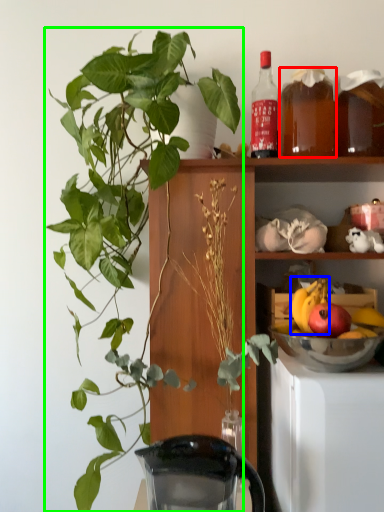
Question: Estimate the real-world distances between objects in this image. Which object is closer to beverage (highlighted by a red box), fruit (highlighted by a blue box) or houseplant (highlighted by a green box)?

Choices:
 (A) fruit
 (B) houseplant

Answer: (A)